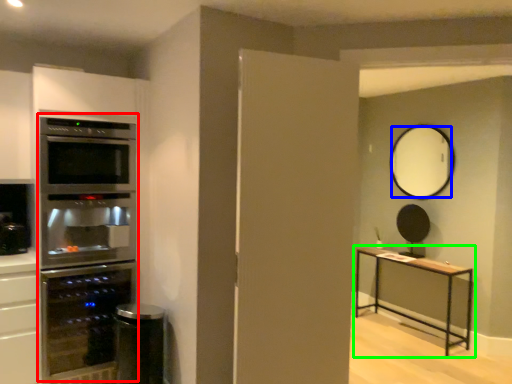
Question: Which is farther away from fridge (highlighted by a red box)? mirror (highlighted by a blue box) or table (highlighted by a green box)?

Choices:
 (A) mirror
 (B) table

Answer: (A)